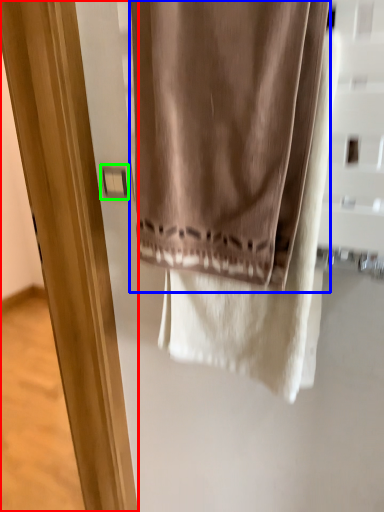
Question: Which object is positioned farthest from screen door (highlighted by a red box)? Select from curtain (highlighted by a blue box) and light switch (highlighted by a green box).

Choices:
 (A) curtain
 (B) light switch

Answer: (A)